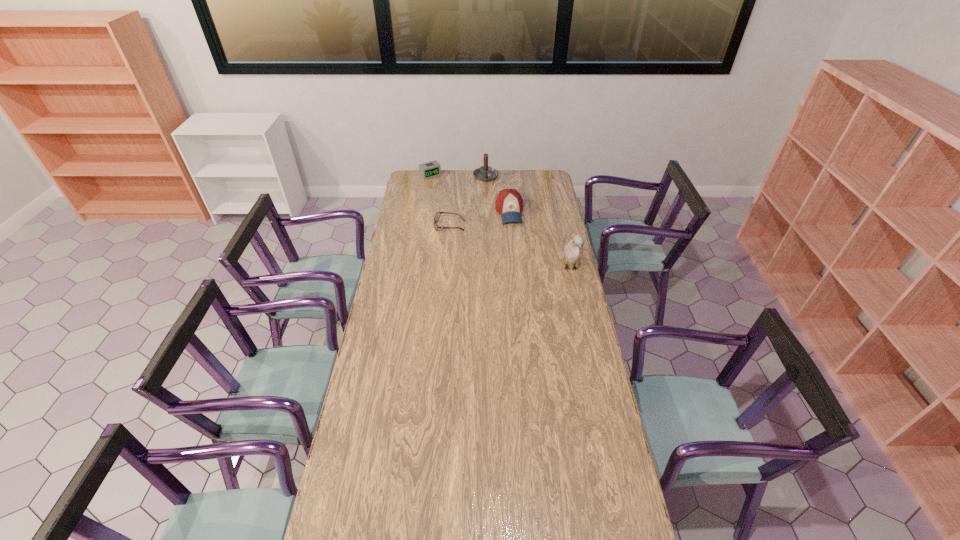
Where is `the shortest object`? the shortest object is located at coordinates (438, 214).

Image resolution: width=960 pixels, height=540 pixels. I want to click on the nearest object, so click(573, 252).

Locate an element on the screen. the rightmost object is located at coordinates (573, 252).

This screenshot has width=960, height=540. Find the location of `candle`. candle is located at coordinates (485, 173).

Locate an element on the screen. This screenshot has height=540, width=960. baseball cap is located at coordinates (509, 203).

Where is `the second shortest object`? This screenshot has width=960, height=540. the second shortest object is located at coordinates (431, 169).

This screenshot has height=540, width=960. What are the coordinates of `vacant space located on the lenses of the sunglasses` in the screenshot? It's located at [x=418, y=226].

Identify the location of vacant region located on the lenses of the sunglasses. The image size is (960, 540). (403, 226).

This screenshot has width=960, height=540. I want to click on vacant space located on the lenses of the sunglasses, so click(423, 226).

The height and width of the screenshot is (540, 960). What are the coordinates of `free space located at the beak of the nearest object` in the screenshot? It's located at [587, 342].